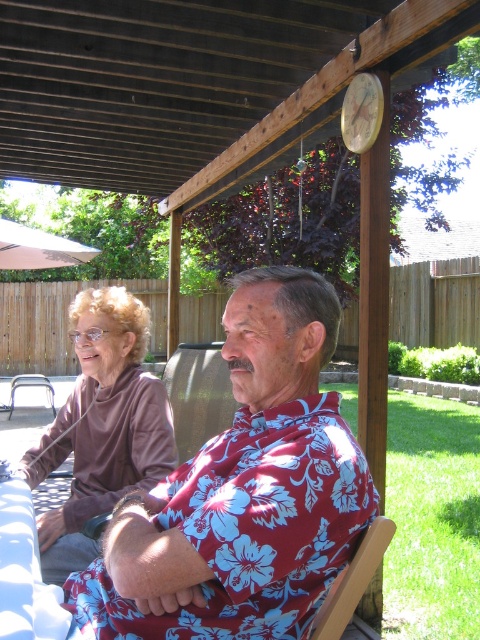
Can you confirm if floral print shirt at center is smaller than brown fleece sweater at left?

Correct, floral print shirt at center occupies less space than brown fleece sweater at left.

Who is more distant from viewer, (257, 429) or (132, 486)?

Positioned behind is point (132, 486).

Where is `floral print shirt at center`? This screenshot has width=480, height=640. floral print shirt at center is located at coordinates (243, 492).

Who is positioned more to the left, brown fleece sweater at left or white fabric umbrella at upper left?

Positioned to the left is white fabric umbrella at upper left.

Does brown fleece sweater at left appear on the right side of white fabric umbrella at upper left?

Correct, you'll find brown fleece sweater at left to the right of white fabric umbrella at upper left.

Does point (88, 490) come in front of point (64, 243)?

Yes, it is.

The image size is (480, 640). I want to click on brown fleece sweater at left, so click(x=101, y=428).

Which is more to the left, brown fleece sweater at left or wooden chair at lower right?

brown fleece sweater at left is more to the left.

Who is taller, brown fleece sweater at left or wooden chair at lower right?

With more height is brown fleece sweater at left.

Does point (81, 508) lie in front of point (373, 547)?

No, it is behind (373, 547).

Locate an element on the screen. brown fleece sweater at left is located at coordinates (101, 428).